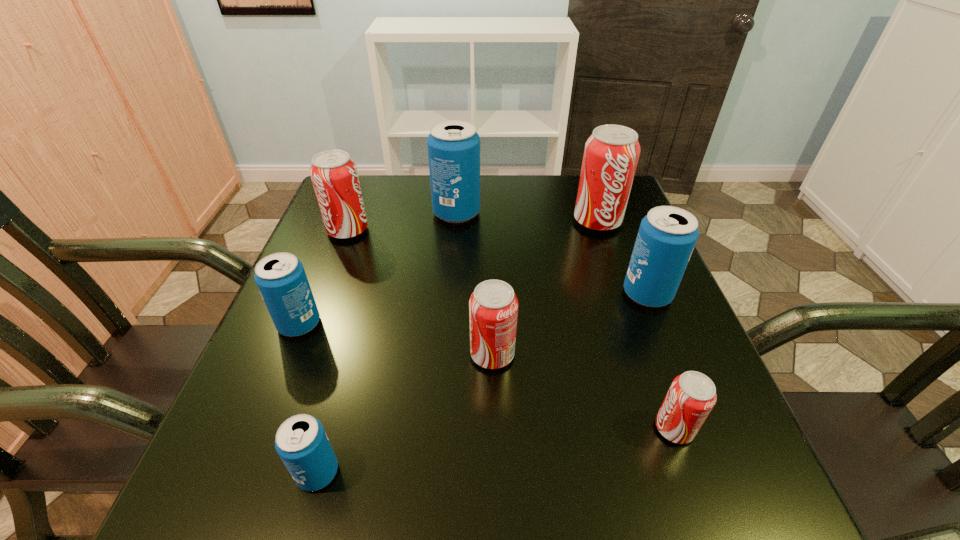
Identify the location of the smallest blue soda can. This screenshot has width=960, height=540. (301, 442).

Locate an element on the screen. the third object from left to right is located at coordinates (301, 442).

The height and width of the screenshot is (540, 960). In order to click on free spot located on the front of the biggest blue soda can in this screenshot , I will do `click(453, 254)`.

At what (x,y) coordinates should I click in order to perform the action: click on free space located on the logo side of the biggest red soda can. Please return your answer as a coordinate pair (x, y). This screenshot has width=960, height=540. Looking at the image, I should click on (612, 265).

At what (x,y) coordinates should I click in order to perform the action: click on vacant space located 0.340m on the logo side of the leftmost red soda can. Please return your answer as a coordinate pair (x, y). The width and height of the screenshot is (960, 540). Looking at the image, I should click on (506, 230).

Where is `vacant space located on the front of the rightmost blue soda can`? This screenshot has width=960, height=540. vacant space located on the front of the rightmost blue soda can is located at coordinates (663, 334).

Where is `vacant point located 0.150m on the logo side of the third red soda can from right to left`? vacant point located 0.150m on the logo side of the third red soda can from right to left is located at coordinates (388, 354).

At what (x,y) coordinates should I click in order to perform the action: click on free location located on the logo side of the third red soda can from right to left. Please return your answer as a coordinate pair (x, y). The width and height of the screenshot is (960, 540). Looking at the image, I should click on (306, 354).

Identify the location of free space located 0.270m on the logo side of the third red soda can from right to left. (323, 354).

Identify the location of free space located 0.130m on the front of the leftmost blue soda can. This screenshot has height=540, width=960. (269, 401).